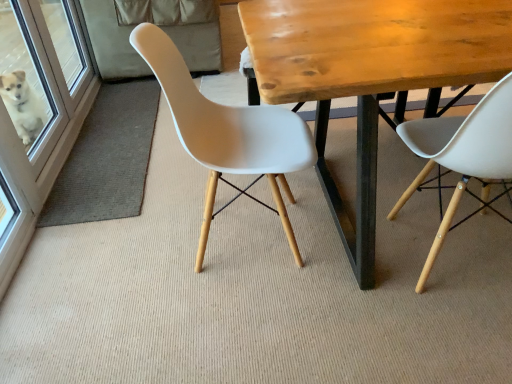
This screenshot has width=512, height=384. What are the coordinates of `free spot in front of white plastic chair at center, the second chair viewed from the right` in the screenshot? It's located at (252, 317).